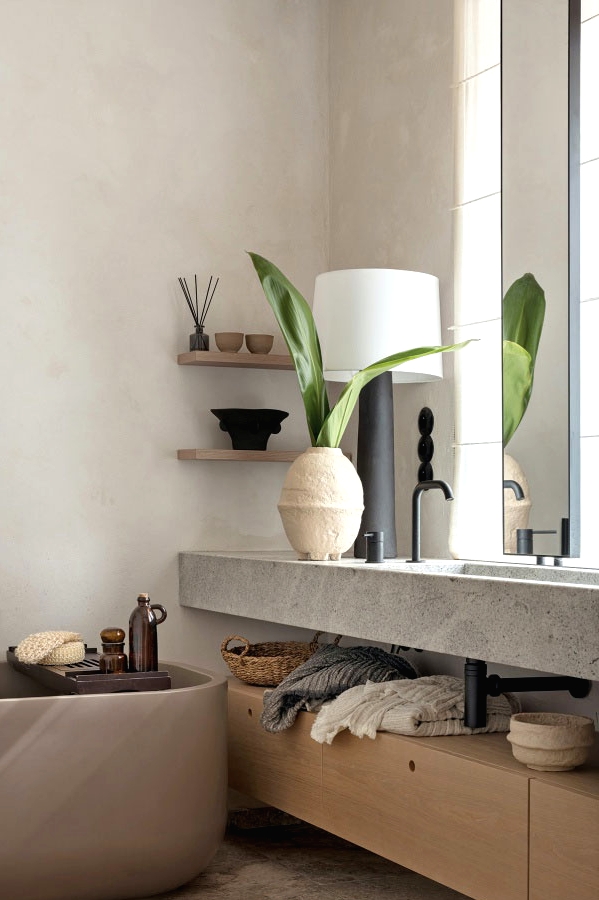
I want to click on drain trap, so click(x=474, y=706).